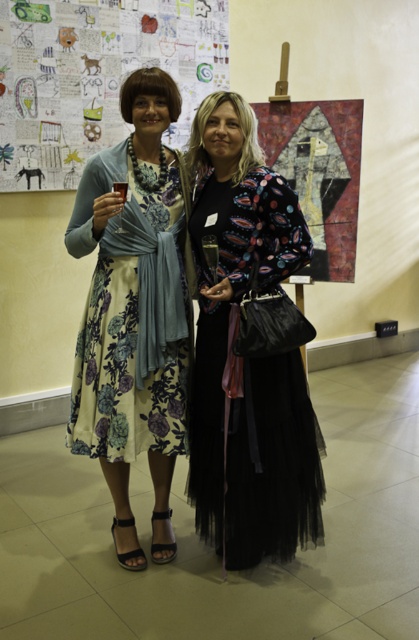
Question: Based on their relative distances, which object is farther from the floral silk dress at center?

Choices:
 (A) black tulle dress at center
 (B) colored paper collage at upper left

Answer: (B)

Question: Considering the relative positions of colored paper collage at upper left and floral silk dress at center in the image provided, where is colored paper collage at upper left located with respect to floral silk dress at center?

Choices:
 (A) above
 (B) below

Answer: (A)

Question: Which point is farther to the camera?

Choices:
 (A) black tulle dress at center
 (B) floral silk dress at center

Answer: (A)

Question: Can you confirm if colored paper collage at upper left is bigger than floral silk dress at center?

Choices:
 (A) yes
 (B) no

Answer: (A)

Question: Does colored paper collage at upper left appear on the right side of floral silk dress at center?

Choices:
 (A) no
 (B) yes

Answer: (A)

Question: Which point is closer to the camera?

Choices:
 (A) (5, 118)
 (B) (216, 497)

Answer: (B)